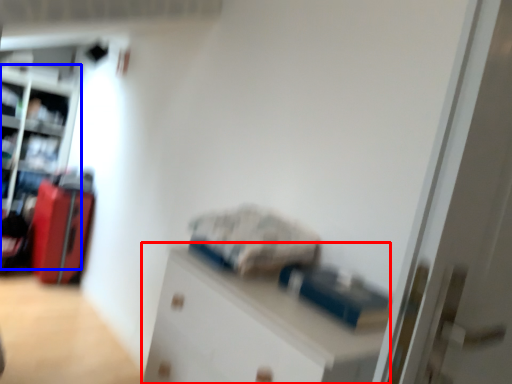
Question: Which object is further to the camera taking this photo, cabinetry (highlighted by a red box) or bookshelf (highlighted by a blue box)?

Choices:
 (A) cabinetry
 (B) bookshelf

Answer: (B)